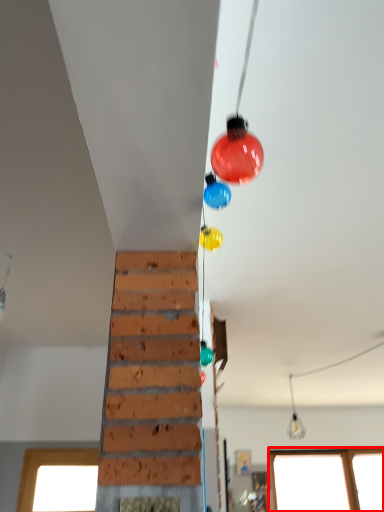
Question: Considering the relative positions of window (annotated by the red box) and light fixture in the image provided, where is window (annotated by the red box) located with respect to the staircase?

Choices:
 (A) right
 (B) left

Answer: (A)